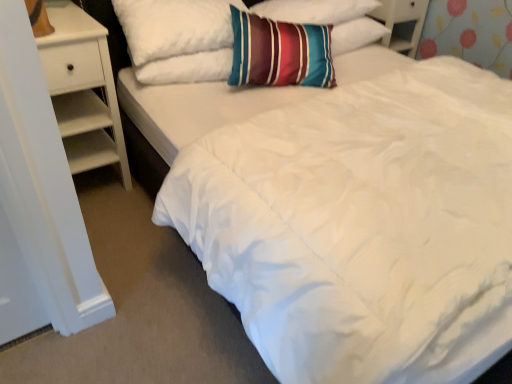
You are a GUI agent. You are given a task and a screenshot of the screen. Output one action in this format:
    pyautogui.click(x=<x>, y=<y>)
    Task: Click on the striped cotton pillow at center, the 1th pillow in the right-to-left sequence
    This screenshot has width=512, height=384.
    Given the screenshot: What is the action you would take?
    pyautogui.click(x=329, y=19)

What is the approximate width of striped cotton pillow at center, the 1th pillow in the right-to-left sequence?

It is 15.91 inches.

Image resolution: width=512 pixels, height=384 pixels. I want to click on striped cotton pillow at center, the 1th pillow in the right-to-left sequence, so click(x=329, y=19).

Does striped fabric pillow at upper center, which is the 1th pillow from left to right, have a greater width compared to white wood dresser at upper right?

In fact, striped fabric pillow at upper center, which is the 1th pillow from left to right, might be narrower than white wood dresser at upper right.

From a real-world perspective, is striped fabric pillow at upper center, which is counted as the second pillow, starting from the right, on top of white wood dresser at upper right?

Correct, in the physical world, striped fabric pillow at upper center, which is counted as the second pillow, starting from the right, is higher than white wood dresser at upper right.

In terms of size, does striped fabric pillow at upper center, which is counted as the second pillow, starting from the right, appear bigger or smaller than white wood dresser at upper right?

In the image, striped fabric pillow at upper center, which is counted as the second pillow, starting from the right, appears to be larger than white wood dresser at upper right.

Is point (389, 1) closer or farther from the camera than point (198, 56)?

Clearly, point (389, 1) is more distant from the camera than point (198, 56).

From a real-world perspective, between white wood dresser at upper right and striped fabric pillow at upper center, which is counted as the second pillow, starting from the right, who is vertically higher?

In real-world perspective, striped fabric pillow at upper center, which is counted as the second pillow, starting from the right, is above.

Looking at their sizes, would you say white wood dresser at upper right is wider or thinner than striped fabric pillow at upper center, which is counted as the second pillow, starting from the right?

Considering their sizes, white wood dresser at upper right looks broader than striped fabric pillow at upper center, which is counted as the second pillow, starting from the right.

From the image's perspective, does white wood dresser at upper right appear lower than striped fabric pillow at upper center, which is counted as the second pillow, starting from the right?

Incorrect, from the image's perspective, white wood dresser at upper right is higher than striped fabric pillow at upper center, which is counted as the second pillow, starting from the right.

Between striped cotton pillow at center, positioned as the second pillow in left-to-right order, and white wood nightstand at left, which one has less height?

striped cotton pillow at center, positioned as the second pillow in left-to-right order, is shorter.

From a real-world perspective, is striped cotton pillow at center, positioned as the second pillow in left-to-right order, physically located above or below white wood nightstand at left?

Clearly, from a real-world perspective, striped cotton pillow at center, positioned as the second pillow in left-to-right order, is above white wood nightstand at left.

Looking at this image, looking at the image, does striped cotton pillow at center, the 1th pillow in the right-to-left sequence, seem bigger or smaller compared to white wood nightstand at left?

A: striped cotton pillow at center, the 1th pillow in the right-to-left sequence, is smaller than white wood nightstand at left.

Is striped fabric pillow at upper center, which is counted as the second pillow, starting from the right, wider or thinner than striped cotton pillow at center, the 1th pillow in the right-to-left sequence?

Considering their sizes, striped fabric pillow at upper center, which is counted as the second pillow, starting from the right, looks broader than striped cotton pillow at center, the 1th pillow in the right-to-left sequence.

Does striped fabric pillow at upper center, which is the 1th pillow from left to right, appear on the left side of striped cotton pillow at center, the 1th pillow in the right-to-left sequence?

Yes.

Is striped fabric pillow at upper center, which is counted as the second pillow, starting from the right, behind striped cotton pillow at center, positioned as the second pillow in left-to-right order?

No.

Would you say striped fabric pillow at upper center, which is counted as the second pillow, starting from the right, contains striped cotton pillow at center, positioned as the second pillow in left-to-right order?

No, striped cotton pillow at center, positioned as the second pillow in left-to-right order, is not inside striped fabric pillow at upper center, which is counted as the second pillow, starting from the right.

Can you tell me how much striped fabric pillow at upper center, which is counted as the second pillow, starting from the right, and white wood nightstand at left differ in facing direction?

There is a 0.794-degree angle between the facing directions of striped fabric pillow at upper center, which is counted as the second pillow, starting from the right, and white wood nightstand at left.

Which object is further away from the camera, striped fabric pillow at upper center, which is the 1th pillow from left to right, or white wood nightstand at left?

striped fabric pillow at upper center, which is the 1th pillow from left to right, is more distant.

Is striped fabric pillow at upper center, which is counted as the second pillow, starting from the right, with white wood nightstand at left?

There is a gap between striped fabric pillow at upper center, which is counted as the second pillow, starting from the right, and white wood nightstand at left.

Is striped fabric pillow at upper center, which is counted as the second pillow, starting from the right, looking in the opposite direction of white wood nightstand at left?

No.

Is white wood dresser at upper right a part of white wood nightstand at left?

No.

From a real-world perspective, is white wood nightstand at left on white wood dresser at upper right?

No, from a real-world perspective, white wood nightstand at left is not over white wood dresser at upper right

From the image's perspective, who appears lower, white wood nightstand at left or white wood dresser at upper right?

white wood nightstand at left appears lower in the image.

Considering the points (64, 86) and (419, 15), which point is behind, point (64, 86) or point (419, 15)?

The point (419, 15) is farther.

Where is `nightstand to the left of white wood dresser at upper right`? The image size is (512, 384). nightstand to the left of white wood dresser at upper right is located at coordinates coord(83,90).

From a real-world perspective, is white wood dresser at upper right located higher than white wood nightstand at left?

Correct, in the physical world, white wood dresser at upper right is higher than white wood nightstand at left.

Which of these two, white wood dresser at upper right or white wood nightstand at left, stands shorter?

Standing shorter between the two is white wood dresser at upper right.

Are white wood dresser at upper right and white wood nightstand at left far apart?

Yes.

From the image's perspective, count 2nd pillows downward from the white wood dresser at upper right and point to it. Please provide its 2D coordinates.

[(178, 39)]

You are a GUI agent. You are given a task and a screenshot of the screen. Output one action in this format:
    pyautogui.click(x=<x>, y=<y>)
    Task: Click on the 2nd pillow in front when counting from the white wood dresser at upper right
    
    Given the screenshot: What is the action you would take?
    pyautogui.click(x=178, y=39)

From the image, which object appears to be farther from white wood nightstand at left, striped cotton pillow at center, the 1th pillow in the right-to-left sequence, or white wood dresser at upper right?

Based on the image, white wood dresser at upper right appears to be further to white wood nightstand at left.

Based on their spatial positions, is white wood dresser at upper right or white wood nightstand at left closer to striped fabric pillow at upper center, which is counted as the second pillow, starting from the right?

Based on the image, white wood nightstand at left appears to be nearer to striped fabric pillow at upper center, which is counted as the second pillow, starting from the right.

Consider the image. Estimate the real-world distances between objects in this image. Which object is further from white wood nightstand at left, striped fabric pillow at upper center, which is counted as the second pillow, starting from the right, or striped cotton pillow at center, positioned as the second pillow in left-to-right order?

striped cotton pillow at center, positioned as the second pillow in left-to-right order, is positioned further to the anchor white wood nightstand at left.

When comparing their distances from white wood dresser at upper right, does striped fabric pillow at upper center, which is counted as the second pillow, starting from the right, or white wood nightstand at left seem closer?

striped fabric pillow at upper center, which is counted as the second pillow, starting from the right, lies closer to white wood dresser at upper right than the other object.

Estimate the real-world distances between objects in this image. Which object is closer to white wood nightstand at left, white wood dresser at upper right or striped fabric pillow at upper center, which is counted as the second pillow, starting from the right?

striped fabric pillow at upper center, which is counted as the second pillow, starting from the right.

Consider the image. Based on their spatial positions, is white wood nightstand at left or white wood dresser at upper right further from striped cotton pillow at center, positioned as the second pillow in left-to-right order?

Among the two, white wood nightstand at left is located further to striped cotton pillow at center, positioned as the second pillow in left-to-right order.

Which object lies nearer to the anchor point striped cotton pillow at center, the 1th pillow in the right-to-left sequence, striped fabric pillow at upper center, which is the 1th pillow from left to right, or white wood nightstand at left?

striped fabric pillow at upper center, which is the 1th pillow from left to right.

Which object lies further to the anchor point striped cotton pillow at center, positioned as the second pillow in left-to-right order, white wood dresser at upper right or striped fabric pillow at upper center, which is counted as the second pillow, starting from the right?

Based on the image, white wood dresser at upper right appears to be further to striped cotton pillow at center, positioned as the second pillow in left-to-right order.

Locate an element on the screen. The width and height of the screenshot is (512, 384). pillow between striped fabric pillow at upper center, which is the 1th pillow from left to right, and white wood dresser at upper right from left to right is located at coordinates (329, 19).

Locate an element on the screen. The height and width of the screenshot is (384, 512). pillow situated between white wood nightstand at left and striped cotton pillow at center, the 1th pillow in the right-to-left sequence, from left to right is located at coordinates (178, 39).